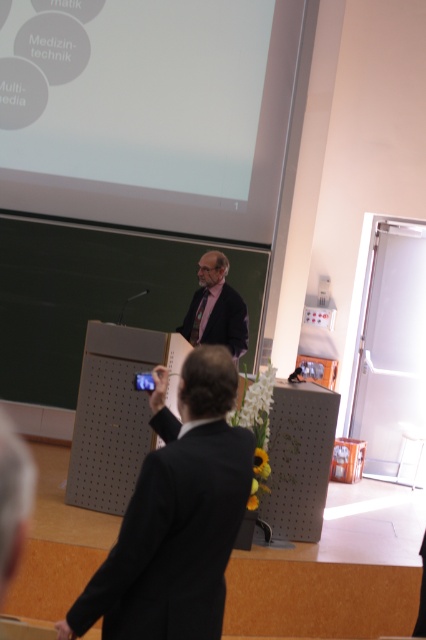
Question: Among these objects, which one is nearest to the camera?

Choices:
 (A) dark suit at center
 (B) white matte projection screen at upper center
 (C) black matte suit at center

Answer: (C)

Question: Which object appears closest to the camera in this image?

Choices:
 (A) white matte projection screen at upper center
 (B) dark suit at center

Answer: (B)

Question: Is white matte projection screen at upper center positioned in front of dark suit at center?

Choices:
 (A) yes
 (B) no

Answer: (B)

Question: Where is black matte suit at center located in relation to dark suit at center in the image?

Choices:
 (A) left
 (B) right

Answer: (A)

Question: Is black matte suit at center above white matte projection screen at upper center?

Choices:
 (A) no
 (B) yes

Answer: (A)

Question: Which point appears farthest from the camera in this image?

Choices:
 (A) (178, 516)
 (B) (271, 83)
 (C) (218, 294)

Answer: (B)